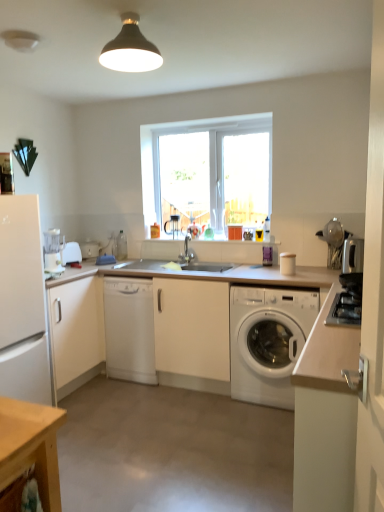
Question: Does white plastic toaster at left contain white matte cabinet at left, which is the first cabinetry from left to right?

Choices:
 (A) no
 (B) yes

Answer: (A)

Question: From a real-world perspective, is white plastic toaster at left on white matte cabinet at left, which appears as the first cabinetry when viewed from the back?

Choices:
 (A) no
 (B) yes

Answer: (B)

Question: Can you confirm if white plastic toaster at left is smaller than white matte cabinet at left, which appears as the first cabinetry when viewed from the back?

Choices:
 (A) no
 (B) yes

Answer: (B)

Question: Is the depth of white plastic toaster at left greater than that of white matte cabinet at left, the second cabinetry positioned from the front?

Choices:
 (A) no
 (B) yes

Answer: (B)

Question: Are white plastic toaster at left and white matte cabinet at left, the second cabinetry positioned from the front, located far from each other?

Choices:
 (A) yes
 (B) no

Answer: (B)

Question: Can you confirm if white plastic toaster at left is thinner than white matte cabinet at left, the second cabinetry positioned from the front?

Choices:
 (A) no
 (B) yes

Answer: (B)

Question: Can you confirm if white plastic toaster at left, positioned as the 1th appliance in left-to-right order, is shorter than white plastic washing machine at center?

Choices:
 (A) no
 (B) yes

Answer: (B)

Question: Can you confirm if white plastic toaster at left, the third appliance in the right-to-left sequence, is positioned to the right of white plastic washing machine at center?

Choices:
 (A) no
 (B) yes

Answer: (A)

Question: Is white plastic toaster at left, placed as the first appliance when sorted from back to front, closer to the viewer compared to white plastic washing machine at center?

Choices:
 (A) no
 (B) yes

Answer: (A)

Question: From the image's perspective, would you say white plastic toaster at left, placed as the first appliance when sorted from back to front, is shown under white plastic washing machine at center?

Choices:
 (A) yes
 (B) no

Answer: (B)

Question: Does white plastic toaster at left, placed as the first appliance when sorted from back to front, contain white plastic washing machine at center?

Choices:
 (A) no
 (B) yes

Answer: (A)

Question: Is white plastic toaster at left, the 3th appliance from the front, wider than white plastic washing machine at center?

Choices:
 (A) yes
 (B) no

Answer: (B)

Question: Could you tell me if satin silver toaster at right, the third appliance from the back, is turned towards white matte countertop at center?

Choices:
 (A) no
 (B) yes

Answer: (A)